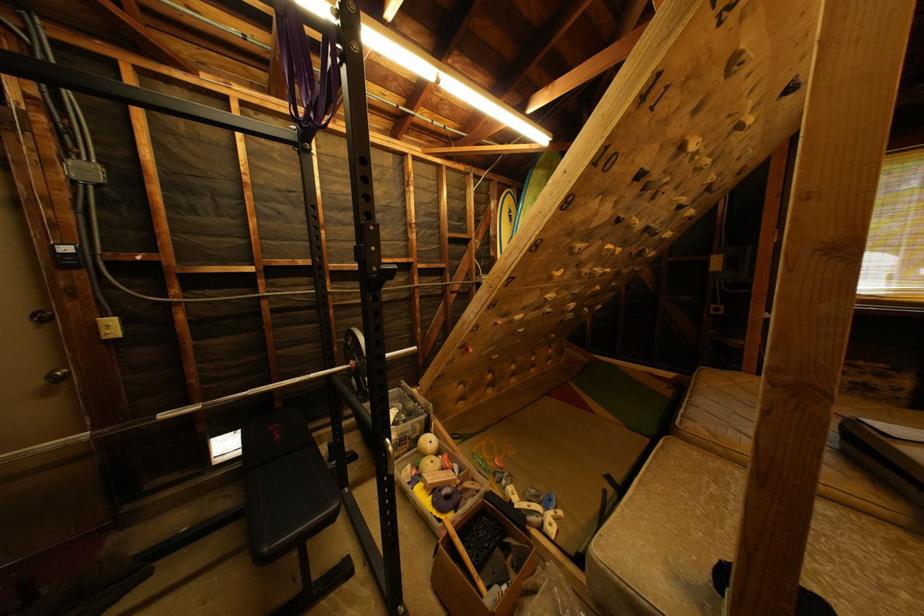
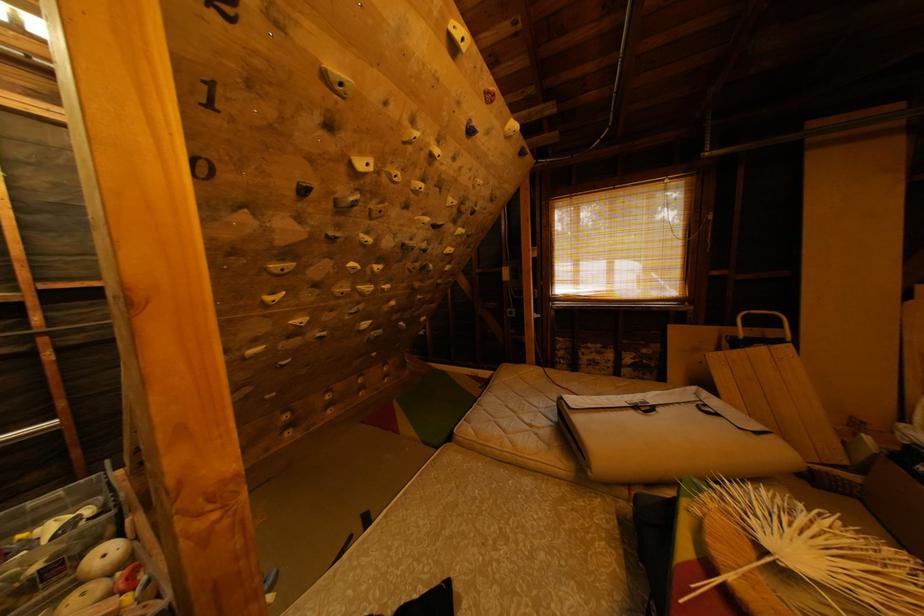
Question: The images are taken continuously from a first-person perspective. In which direction are you moving?

Choices:
 (A) Left
 (B) Right
 (C) Forward
 (D) Backward

Answer: (B)